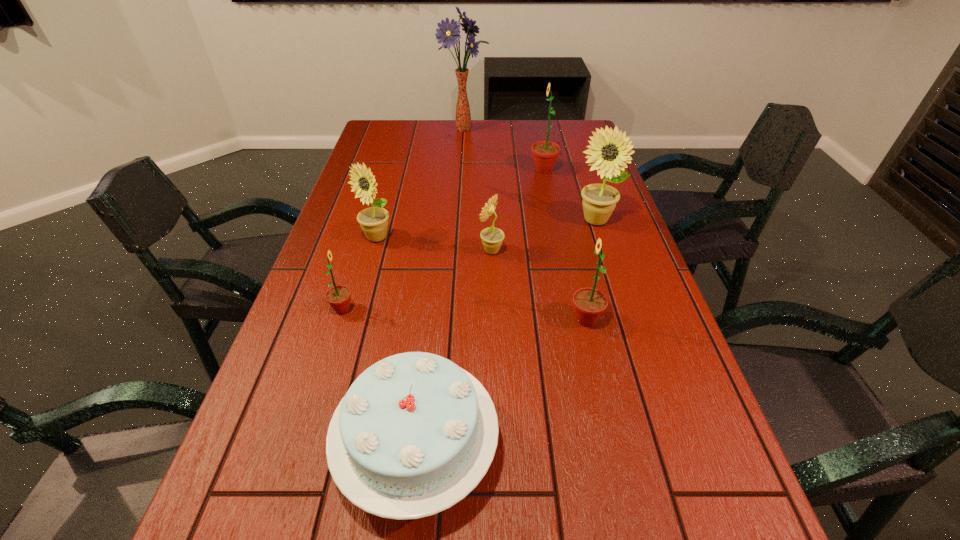
Identify which object is the sixth closest to the nearest object. Please provide its 2D coordinates. Your answer should be formatted as a tuple, i.e. [(x, y)], where the tuple contains the x and y coordinates of a point satisfying the conditions above.

[(545, 153)]

The width and height of the screenshot is (960, 540). Find the location of `the second closest sunflower relative to the leftmost yellow sunflower`. the second closest sunflower relative to the leftmost yellow sunflower is located at coordinates (492, 238).

Locate which sunflower ranks second in proximity to the biggest yellow sunflower. Please provide its 2D coordinates. Your answer should be formatted as a tuple, i.e. [(x, y)], where the tuple contains the x and y coordinates of a point satisfying the conditions above.

[(492, 238)]

Locate an element on the screen. This screenshot has width=960, height=540. green sunflower that is the second closest one to the nearest object is located at coordinates (589, 303).

Identify which green sunflower is the closest to the leftmost green sunflower. Please provide its 2D coordinates. Your answer should be formatted as a tuple, i.e. [(x, y)], where the tuple contains the x and y coordinates of a point satisfying the conditions above.

[(589, 303)]

The height and width of the screenshot is (540, 960). Find the location of `the closest yellow sunflower to the second yellow sunflower from left to right`. the closest yellow sunflower to the second yellow sunflower from left to right is located at coordinates (609, 150).

Locate an element on the screen. the second closest yellow sunflower to the birthday cake is located at coordinates (374, 221).

The width and height of the screenshot is (960, 540). Find the location of `vacant space that satisfies the following two spatial constraints: 1. on the face of the birthday cake; 2. on the right side of the smallest green sunflower`. vacant space that satisfies the following two spatial constraints: 1. on the face of the birthday cake; 2. on the right side of the smallest green sunflower is located at coordinates (300, 449).